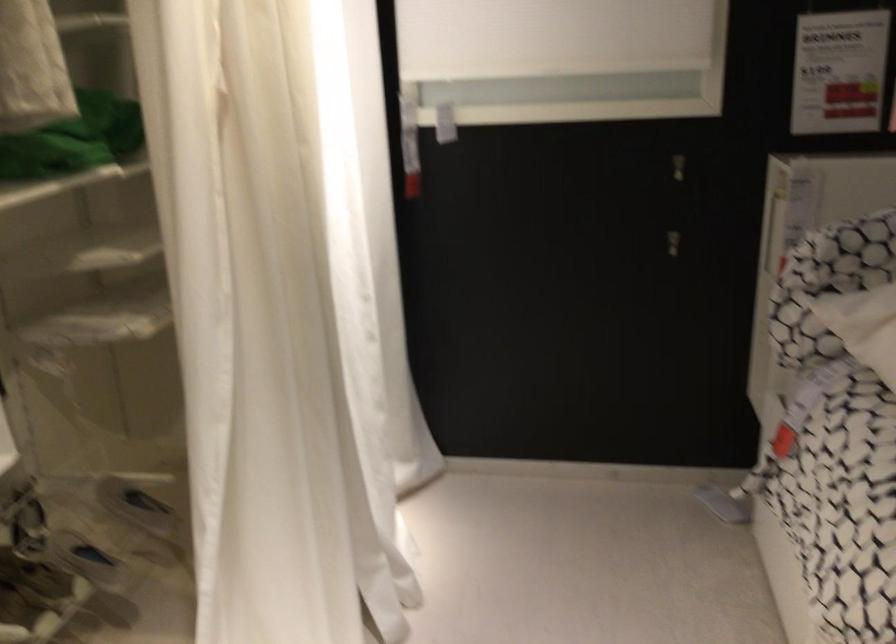
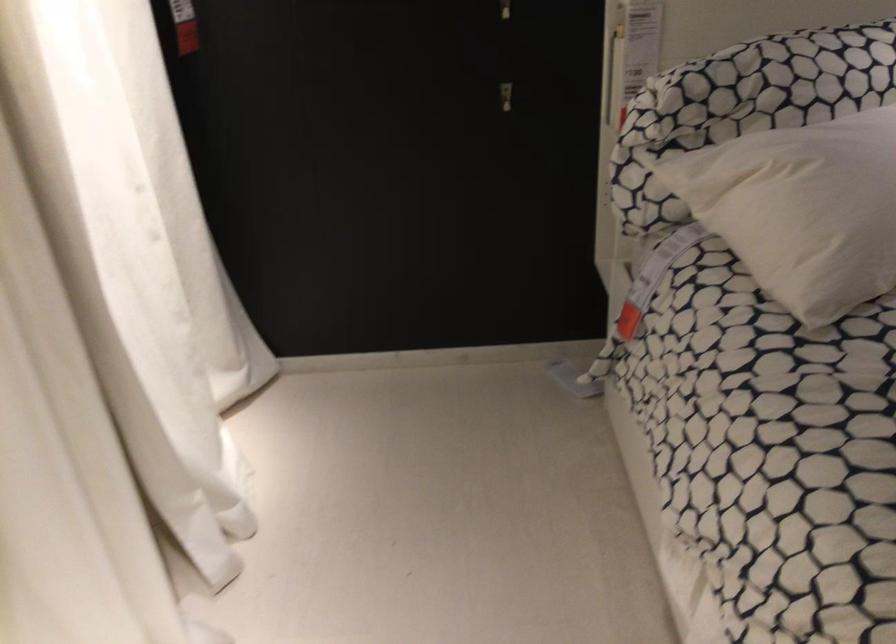
The images are taken continuously from a first-person perspective. In which direction are you moving?

The movement direction of the cameraman is right, forward.